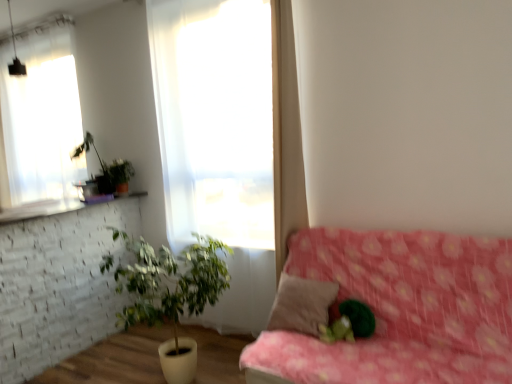
Question: Does green leafy plant at upper left, the second houseplant in the bottom-to-top sequence, appear on the right side of pink floral fabric couch at lower right?

Choices:
 (A) no
 (B) yes

Answer: (A)

Question: Is green leafy plant at upper left, the first houseplant positioned from the left, not near pink floral fabric couch at lower right?

Choices:
 (A) yes
 (B) no

Answer: (A)

Question: Is green leafy plant at upper left, the second houseplant in the front-to-back sequence, thinner than pink floral fabric couch at lower right?

Choices:
 (A) yes
 (B) no

Answer: (A)

Question: Is green leafy plant at upper left, placed as the 1th houseplant when sorted from top to bottom, positioned behind pink floral fabric couch at lower right?

Choices:
 (A) no
 (B) yes

Answer: (B)

Question: Is green leafy plant at upper left, placed as the 1th houseplant when sorted from top to bottom, with pink floral fabric couch at lower right?

Choices:
 (A) no
 (B) yes

Answer: (A)

Question: From a real-world perspective, is green leafy plant at upper left, placed as the 1th houseplant when sorted from top to bottom, positioned above or below green leafy plant in white pot at lower left, the 2th houseplant in the top-to-bottom sequence?

Choices:
 (A) below
 (B) above

Answer: (B)

Question: In the image, is green leafy plant at upper left, the first houseplant positioned from the left, on the left side or the right side of green leafy plant in white pot at lower left, the 2th houseplant in the top-to-bottom sequence?

Choices:
 (A) right
 (B) left

Answer: (B)

Question: Looking at the image, does green leafy plant at upper left, the second houseplant in the bottom-to-top sequence, seem bigger or smaller compared to green leafy plant in white pot at lower left, which is counted as the first houseplant, starting from the bottom?

Choices:
 (A) big
 (B) small

Answer: (B)

Question: Considering their positions, is green leafy plant at upper left, placed as the 2th houseplant when sorted from right to left, located in front of or behind green leafy plant in white pot at lower left, placed as the second houseplant when sorted from back to front?

Choices:
 (A) behind
 (B) front

Answer: (A)

Question: Is pink floral fabric couch at lower right in front of or behind green leafy plant at upper left, the second houseplant in the front-to-back sequence, in the image?

Choices:
 (A) behind
 (B) front

Answer: (B)

Question: Would you say pink floral fabric couch at lower right is inside or outside green leafy plant at upper left, the second houseplant in the bottom-to-top sequence?

Choices:
 (A) inside
 (B) outside

Answer: (B)

Question: From a real-world perspective, relative to green leafy plant at upper left, the second houseplant in the front-to-back sequence, is pink floral fabric couch at lower right vertically above or below?

Choices:
 (A) above
 (B) below

Answer: (B)

Question: Considering the positions of pink floral fabric couch at lower right and green leafy plant at upper left, which appears as the first houseplant when viewed from the back, in the image, is pink floral fabric couch at lower right bigger or smaller than green leafy plant at upper left, which appears as the first houseplant when viewed from the back,?

Choices:
 (A) big
 (B) small

Answer: (A)

Question: From the image's perspective, is green leafy plant in white pot at lower left, which is the 2th houseplant from left to right, positioned above or below green fuzzy ball at center?

Choices:
 (A) above
 (B) below

Answer: (B)

Question: Relative to green fuzzy ball at center, is green leafy plant in white pot at lower left, which is counted as the first houseplant, starting from the bottom, in front or behind?

Choices:
 (A) front
 (B) behind

Answer: (B)